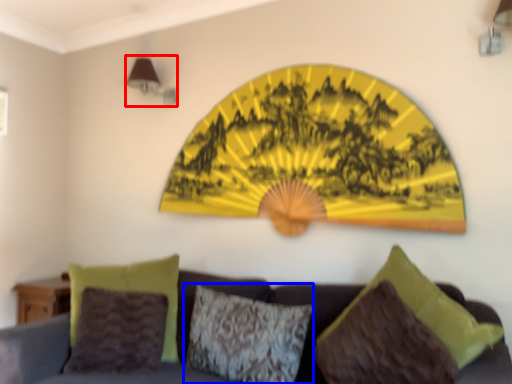
Question: Which of the following is the closest to the observer, lamp (highlighted by a red box) or pillow (highlighted by a blue box)?

Choices:
 (A) lamp
 (B) pillow

Answer: (B)